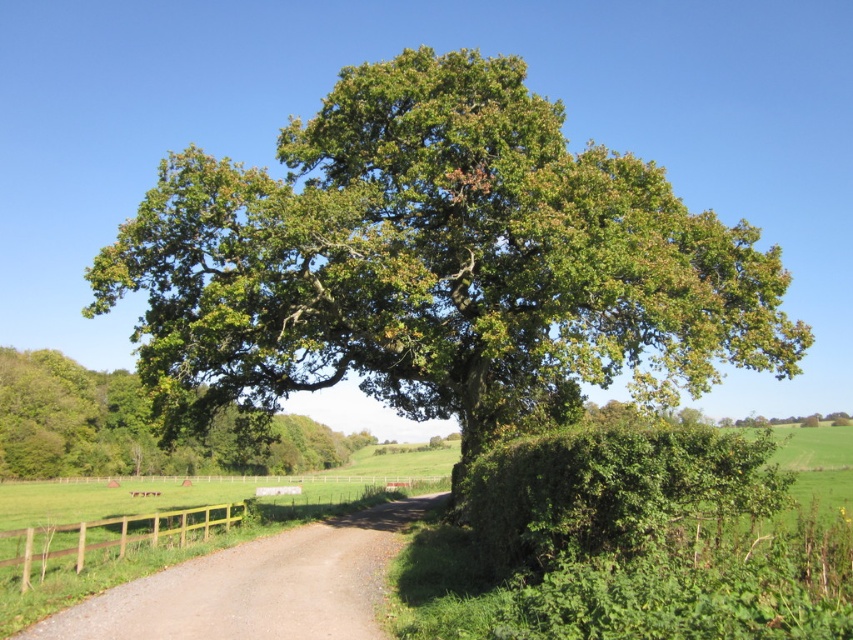
You are standing at the edge of the dirt road at center and want to see what is behind the brown wooden fence at lower left. Which object is taller, allowing you to see over it?

The dirt road at center is not as tall as brown wooden fence at lower left, so you cannot see over the brown wooden fence at lower left.

You are standing on the dirt path and want to take a photo of both the green leafy oak at center and the green leafy tree at center. Which one is closer to you so that you can focus on it first?

The green leafy oak at center is closer to you because it is in front of the green leafy tree at center.